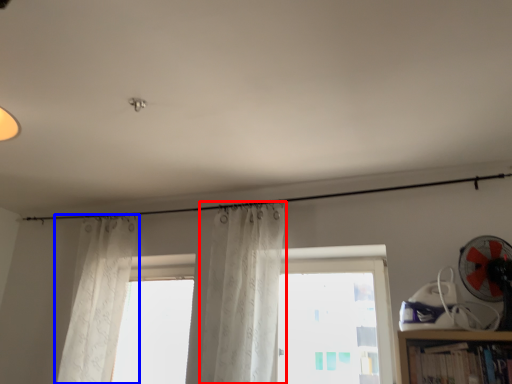
Question: Among these objects, which one is farthest to the camera, curtain (highlighted by a red box) or curtain (highlighted by a blue box)?

Choices:
 (A) curtain
 (B) curtain

Answer: (B)